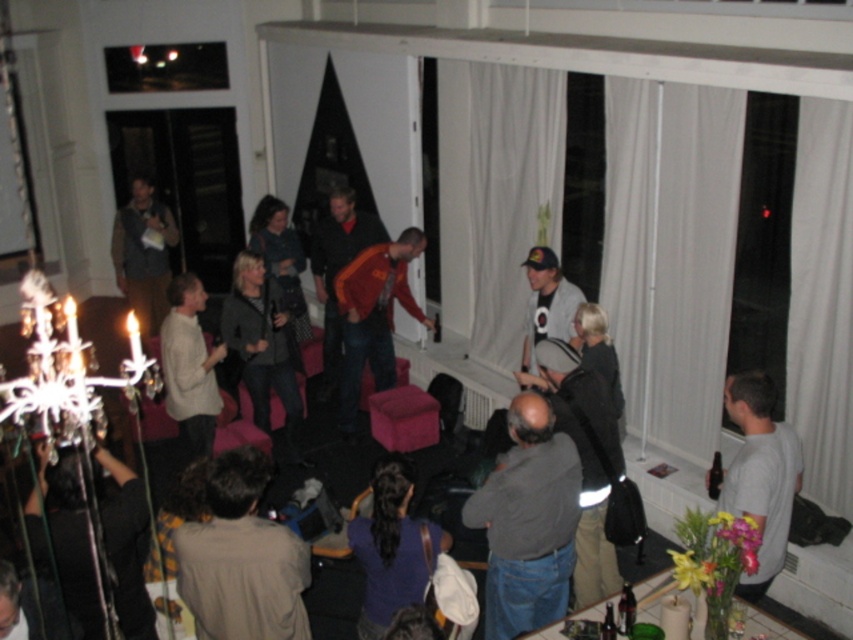
Question: Which point is farther to the camera?

Choices:
 (A) light brown shirt at lower center
 (B) gray cotton t-shirt at right

Answer: (B)

Question: Can you confirm if gray cotton shirt at center is thinner than dark gray shirt at center?

Choices:
 (A) no
 (B) yes

Answer: (B)

Question: Which of the following is the closest to the observer?

Choices:
 (A) gray cotton t-shirt at right
 (B) white cotton t-shirt at center
 (C) matte gray sweater at center
 (D) orange fabric jacket at center

Answer: (A)

Question: Does gray cotton shirt at center have a smaller size compared to light brown shirt at lower center?

Choices:
 (A) yes
 (B) no

Answer: (B)

Question: In this image, where is gray cotton t-shirt at right located relative to orange fleece jacket at center?

Choices:
 (A) above
 (B) below

Answer: (B)

Question: Which point is farther to the camera?

Choices:
 (A) (552, 285)
 (B) (161, 230)
 (C) (190, 380)
 (D) (345, 243)

Answer: (B)